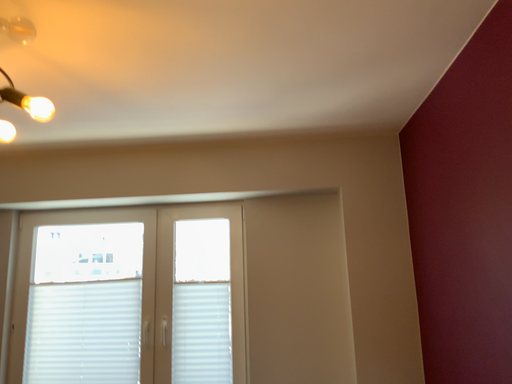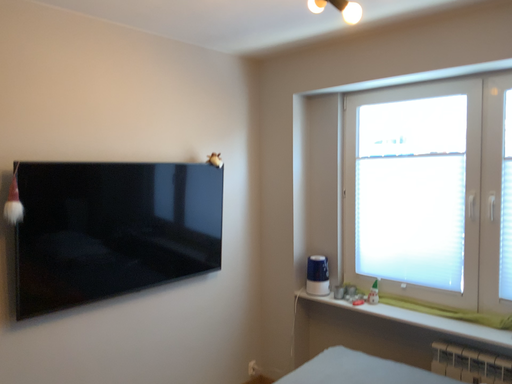
Question: Which way did the camera rotate in the video?

Choices:
 (A) rotated left
 (B) rotated right

Answer: (A)